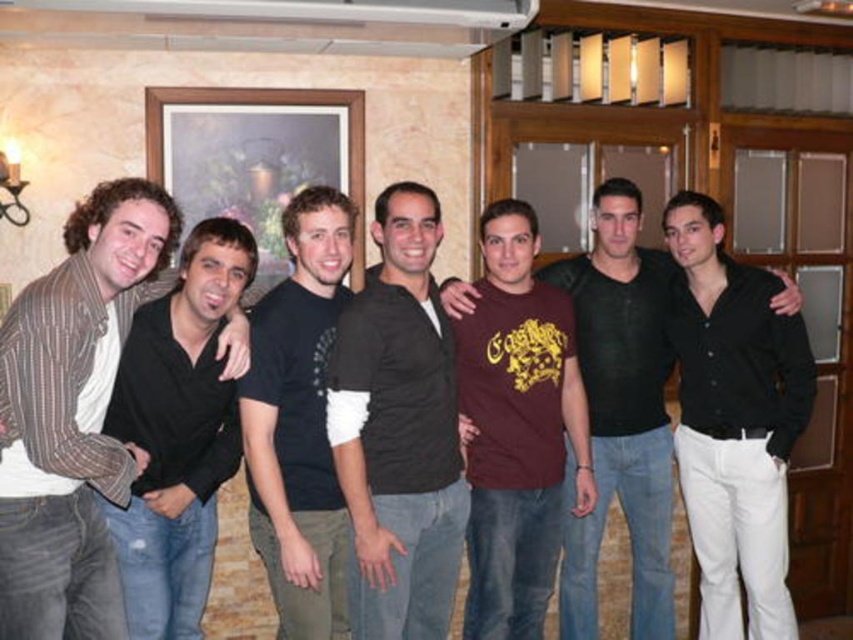
Question: Can you confirm if striped wool sweater at left is thinner than black matte t-shirt at center?

Choices:
 (A) yes
 (B) no

Answer: (B)

Question: Which of the following is the closest to the observer?

Choices:
 (A) maroon cotton t-shirt at center
 (B) striped wool sweater at left

Answer: (B)

Question: Does black matte shirt at center have a greater width compared to maroon cotton t-shirt at center?

Choices:
 (A) no
 (B) yes

Answer: (A)

Question: Is striped wool sweater at left to the right of black matte t-shirt at center from the viewer's perspective?

Choices:
 (A) yes
 (B) no

Answer: (B)

Question: Which of these objects is positioned farthest from the black matte t-shirt at center?

Choices:
 (A) striped wool sweater at left
 (B) maroon jersey at center
 (C) dark brown shirt at center
 (D) black matte shirt at center

Answer: (D)

Question: Based on their relative distances, which object is nearer to the black matte t-shirt at center?

Choices:
 (A) maroon jersey at center
 (B) maroon cotton t-shirt at center
 (C) black matte shirt at center
 (D) striped wool sweater at left

Answer: (D)